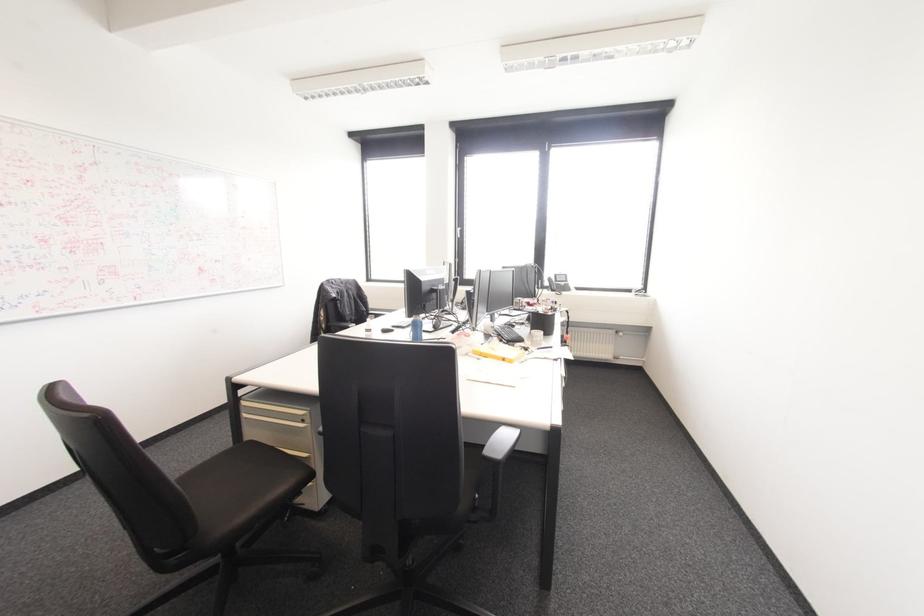
What do you see at coordinates (237, 491) in the screenshot? I see `the black chair sitting surface` at bounding box center [237, 491].